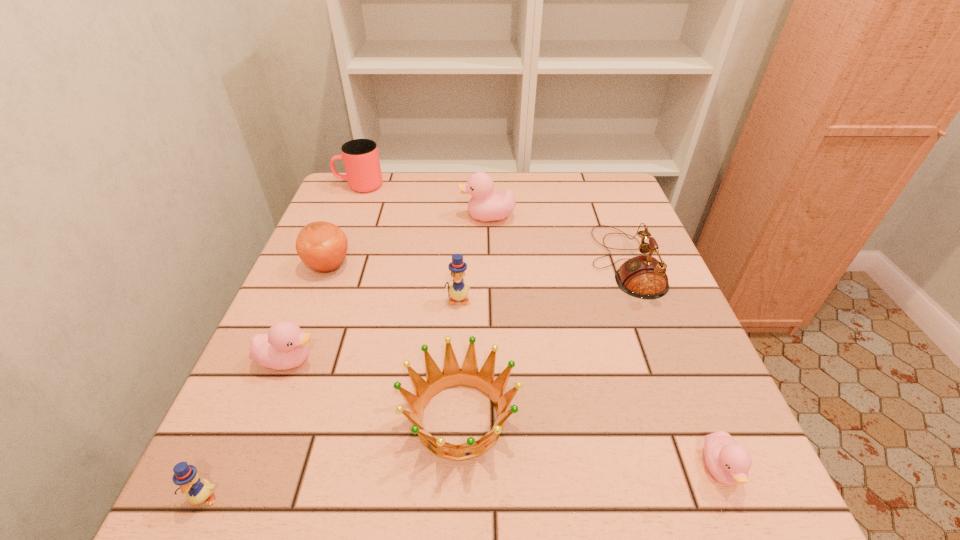
I want to click on vacant region between the second biggest pink duckling and the biggest pink duckling, so click(x=388, y=289).

Find the location of a particular element. object that ranks as the closest to the third nearest duckling is located at coordinates (468, 375).

Select which object is the seventh closest to the smaller yellow duckling. Please provide its 2D coordinates. Your answer should be formatted as a tuple, i.e. [(x, y)], where the tuple contains the x and y coordinates of a point satisfying the conditions above.

[(644, 277)]

Identify which duckling is located as the nearest to the cup. Please provide its 2D coordinates. Your answer should be formatted as a tuple, i.e. [(x, y)], where the tuple contains the x and y coordinates of a point satisfying the conditions above.

[(484, 206)]

Image resolution: width=960 pixels, height=540 pixels. What are the coordinates of `duckling that is the fourth closest to the farthest duckling` in the screenshot? It's located at (186, 476).

Identify which pink duckling is the closest to the orange. Please provide its 2D coordinates. Your answer should be formatted as a tuple, i.e. [(x, y)], where the tuple contains the x and y coordinates of a point satisfying the conditions above.

[(285, 346)]

Locate which pink duckling is the second closest to the second pink duckling from left to right. Please provide its 2D coordinates. Your answer should be formatted as a tuple, i.e. [(x, y)], where the tuple contains the x and y coordinates of a point satisfying the conditions above.

[(729, 462)]

I want to click on free space that satisfies the following two spatial constraints: 1. on the rotary dial of the telephone; 2. on the front side of the crown, so click(x=684, y=417).

At what (x,y) coordinates should I click in order to perform the action: click on free spot that satisfies the following two spatial constraints: 1. on the rotary dial of the pink telephone; 2. on the front side of the orange orange. Please return your answer as a coordinate pair (x, y). The image size is (960, 540). Looking at the image, I should click on (626, 266).